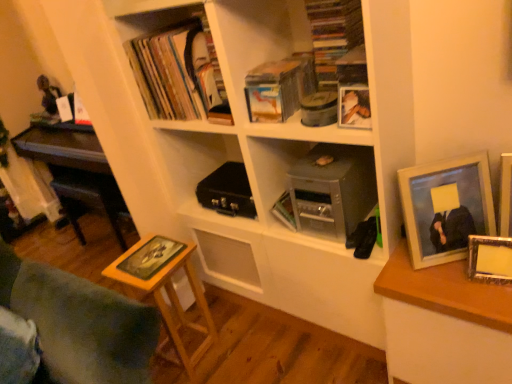
Question: Considering the relative positions of wooden photo frame at right, positioned as the second picture frame in right-to-left order, and white matte bookcase at center in the image provided, is wooden photo frame at right, positioned as the second picture frame in right-to-left order, to the left of white matte bookcase at center from the viewer's perspective?

Choices:
 (A) yes
 (B) no

Answer: (B)

Question: Does wooden photo frame at right, which ranks as the third picture frame in left-to-right order, turn towards white matte bookcase at center?

Choices:
 (A) yes
 (B) no

Answer: (B)

Question: Are wooden photo frame at right, positioned as the second picture frame in right-to-left order, and white matte bookcase at center beside each other?

Choices:
 (A) yes
 (B) no

Answer: (B)

Question: Would you say wooden photo frame at right, which ranks as the third picture frame in left-to-right order, contains white matte bookcase at center?

Choices:
 (A) no
 (B) yes

Answer: (A)

Question: Is wooden photo frame at right, which ranks as the third picture frame in left-to-right order, thinner than white matte bookcase at center?

Choices:
 (A) no
 (B) yes

Answer: (B)

Question: Is wooden photo frame at right, which ranks as the third picture frame in left-to-right order, bigger than white matte bookcase at center?

Choices:
 (A) no
 (B) yes

Answer: (A)

Question: Is hardcover book at upper center touching yellow matte board game at lower left, placed as the first book when sorted from left to right?

Choices:
 (A) no
 (B) yes

Answer: (A)

Question: From the image's perspective, would you say hardcover book at upper center is positioned over yellow matte board game at lower left, arranged as the 3th book when viewed from the top?

Choices:
 (A) yes
 (B) no

Answer: (A)

Question: Is hardcover book at upper center facing away from yellow matte board game at lower left, arranged as the 3th book when viewed from the top?

Choices:
 (A) yes
 (B) no

Answer: (B)

Question: Is hardcover book at upper center positioned beyond the bounds of yellow matte board game at lower left, arranged as the 3th book when viewed from the top?

Choices:
 (A) yes
 (B) no

Answer: (A)

Question: From a real-world perspective, does hardcover book at upper center stand above yellow matte board game at lower left, placed as the third book when sorted from right to left?

Choices:
 (A) no
 (B) yes

Answer: (B)

Question: From the image's perspective, is hardcover book at upper center located beneath yellow matte board game at lower left, arranged as the 3th book when viewed from the top?

Choices:
 (A) yes
 (B) no

Answer: (B)

Question: Does metallic gray briefcase at center have a greater width compared to matte black book at upper left, positioned as the 1th book in top-to-bottom order?

Choices:
 (A) no
 (B) yes

Answer: (B)